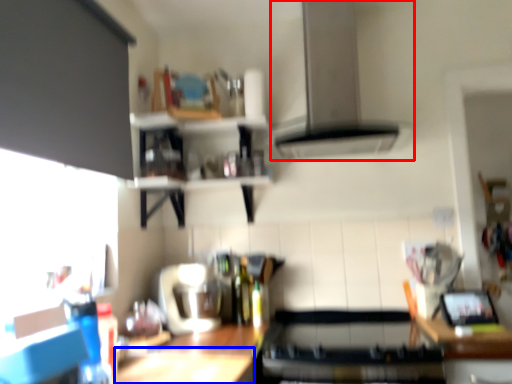
Question: Which object is further to the camera taking this photo, exhaust hood (highlighted by a red box) or table (highlighted by a blue box)?

Choices:
 (A) exhaust hood
 (B) table

Answer: (A)